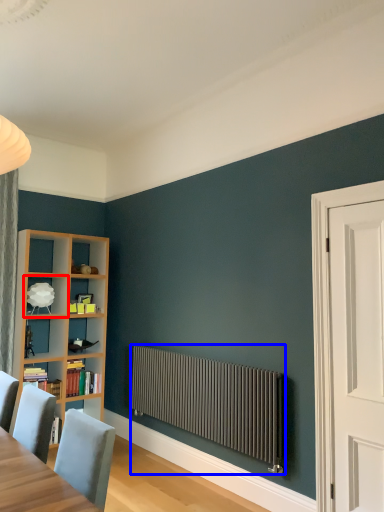
Question: Which of the following is the closest to the observer, shelf (highlighted by a red box) or radiator (highlighted by a blue box)?

Choices:
 (A) shelf
 (B) radiator

Answer: (B)